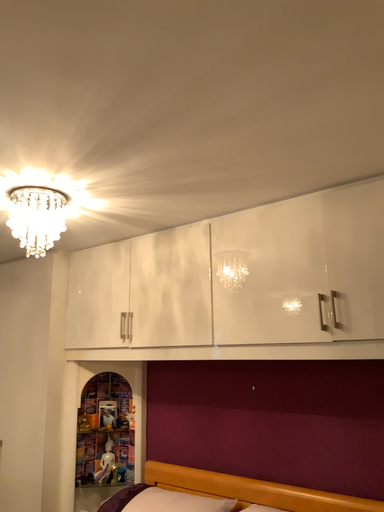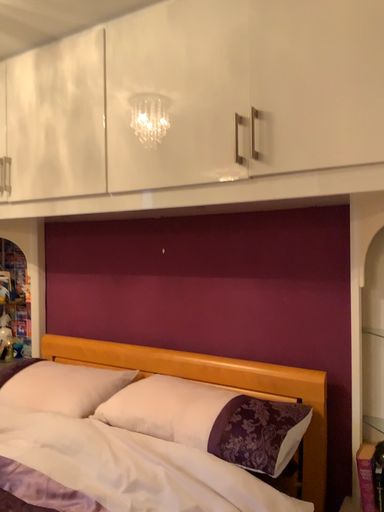
Question: Which way did the camera rotate in the video?

Choices:
 (A) rotated right
 (B) rotated left

Answer: (A)